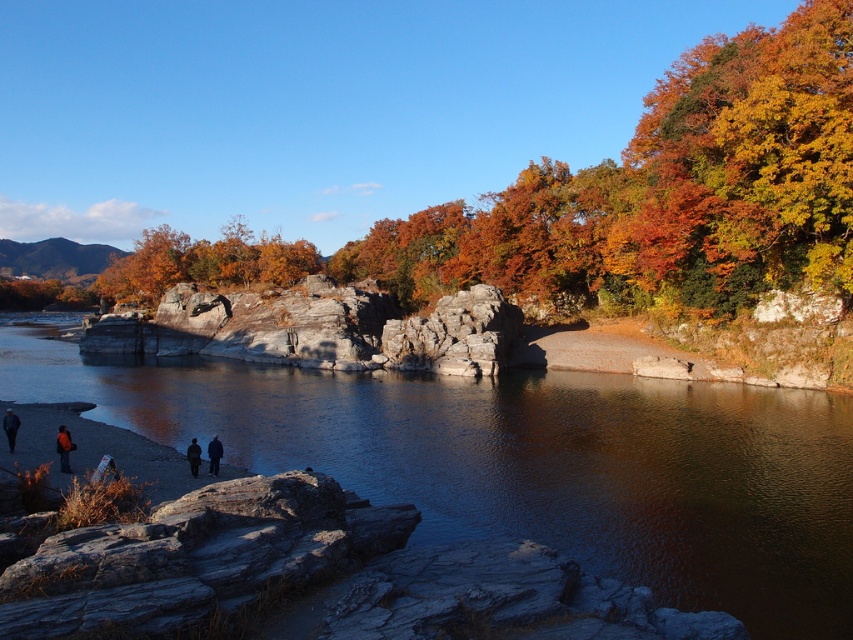
You are a photographer standing at the riverside. You want to capture a photo of the smooth gray river at center and the dark blue fabric jacket at lower left in the same frame. Based on their positions, can you tell which object is closer to the camera?

The dark blue fabric jacket at lower left is closer to the camera because it is positioned below the smooth gray river at center, which is above it.

You are standing at the riverside and want to take a photo of the dark wool coat at center and the orange matte tree at upper right. Which object should you position closer to the left side of your camera frame to include both in the photo?

Since the orange matte tree at upper right is to the right of the dark wool coat at center, you should position the dark wool coat at center closer to the left side of your camera frame to include both in the photo.

You are an artist planning to paint the scene. You need to decide the vertical positioning of the smooth gray river at center and the dark blue fabric jacket at lower left. Based on the scene, which one should be placed higher on the canvas?

The smooth gray river at center should be placed higher on the canvas because it is taller than the dark blue fabric jacket at lower left.